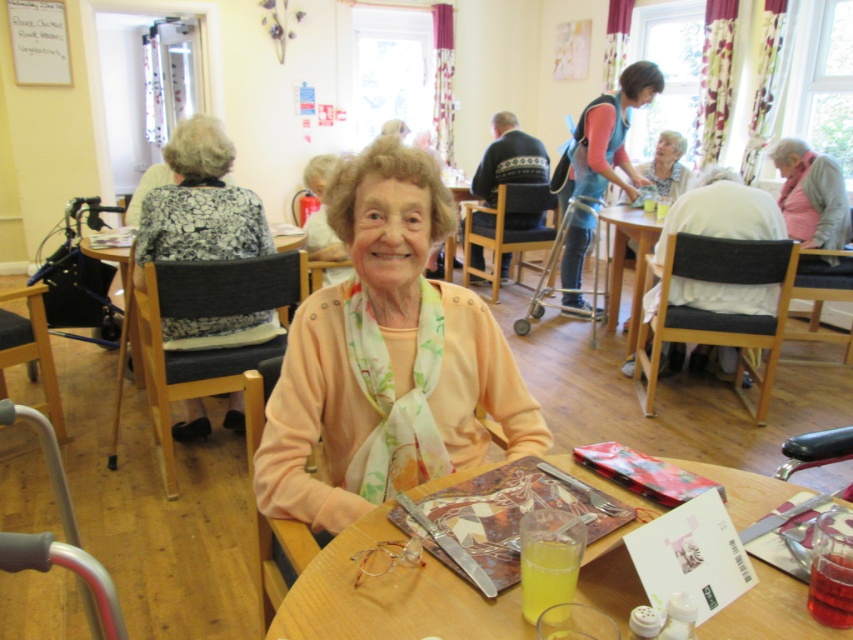
Is translucent yellow liquid at table center positioned before translucent plastic cup at table center?

Yes, translucent yellow liquid at table center is closer to the viewer.

Describe the element at coordinates (547, 570) in the screenshot. This screenshot has height=640, width=853. I see `translucent yellow liquid at table center` at that location.

The width and height of the screenshot is (853, 640). What do you see at coordinates (547, 570) in the screenshot?
I see `translucent yellow liquid at table center` at bounding box center [547, 570].

This screenshot has width=853, height=640. Identify the location of translucent yellow liquid at table center. (547, 570).

Does peach soft fabric at center have a larger size compared to translucent plastic table at center?

Yes.

Who is taller, peach soft fabric at center or translucent plastic table at center?

With more height is peach soft fabric at center.

The width and height of the screenshot is (853, 640). I want to click on peach soft fabric at center, so click(386, 358).

Who is positioned more to the left, black textured blouse at upper left or blue fabric apron at upper right?

black textured blouse at upper left

Does black textured blouse at upper left have a smaller size compared to blue fabric apron at upper right?

Correct, black textured blouse at upper left occupies less space than blue fabric apron at upper right.

At what (x,y) coordinates should I click in order to perform the action: click on black textured blouse at upper left. Please return your answer as a coordinate pair (x, y). The width and height of the screenshot is (853, 640). Looking at the image, I should click on point(199,204).

This screenshot has height=640, width=853. I want to click on black textured blouse at upper left, so pyautogui.click(x=199, y=204).